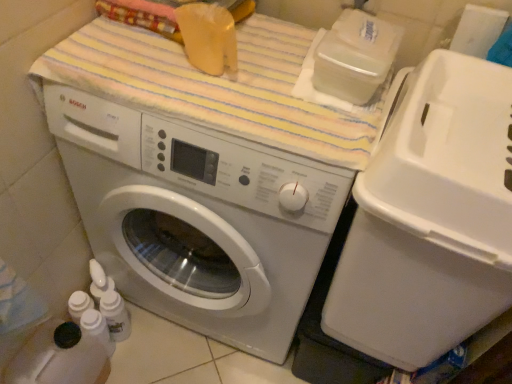
The width and height of the screenshot is (512, 384). What do you see at coordinates (219, 86) in the screenshot? I see `striped cotton bath towel at upper center` at bounding box center [219, 86].

Where is `white plastic water cooler at right`? This screenshot has height=384, width=512. white plastic water cooler at right is located at coordinates (430, 217).

Can you confirm if white plastic water cooler at right is taller than striped cotton bath towel at upper center?

Result: Yes, white plastic water cooler at right is taller than striped cotton bath towel at upper center.

Identify the location of bath towel that appears behind the white plastic water cooler at right. This screenshot has width=512, height=384. (219, 86).

In terms of width, does white plastic water cooler at right look wider or thinner when compared to striped cotton bath towel at upper center?

Considering their sizes, white plastic water cooler at right looks broader than striped cotton bath towel at upper center.

How different are the orientations of white plastic water cooler at right and striped cotton bath towel at upper center in degrees?

The angular difference between white plastic water cooler at right and striped cotton bath towel at upper center is 2.07 degrees.

Is point (315, 122) in front of point (482, 321)?

That is False.

Is striped cotton bath towel at upper center positioned beyond the bounds of white plastic water cooler at right?

striped cotton bath towel at upper center is positioned outside white plastic water cooler at right.

From a real-world perspective, is striped cotton bath towel at upper center positioned above or below white plastic water cooler at right?

From a real-world perspective, striped cotton bath towel at upper center is physically above white plastic water cooler at right.

Between striped cotton bath towel at upper center and white glossy washing machine at center, which one is positioned in front?

white glossy washing machine at center.

Does point (120, 57) lie behind point (250, 330)?

No, it is in front of (250, 330).

Is white glossy washing machine at center inside striped cotton bath towel at upper center?

Definitely not — white glossy washing machine at center is not inside striped cotton bath towel at upper center.

From the picture: Are white glossy washing machine at center and white plastic water cooler at right far apart?

white glossy washing machine at center is actually quite close to white plastic water cooler at right.

Considering the positions of point (256, 204) and point (464, 250), is point (256, 204) closer or farther from the camera than point (464, 250)?

Point (256, 204) is positioned farther from the camera compared to point (464, 250).

Is white glossy washing machine at center located outside white plastic water cooler at right?

Indeed, white glossy washing machine at center is completely outside white plastic water cooler at right.

You are a GUI agent. You are given a task and a screenshot of the screen. Output one action in this format:
    pyautogui.click(x=<x>, y=<y>)
    Task: Click on the washing machine located on the left of white plastic water cooler at right
    The width and height of the screenshot is (512, 384).
    Given the screenshot: What is the action you would take?
    pyautogui.click(x=198, y=218)

Which is more to the left, white glossy washing machine at center or striped cotton bath towel at upper center?

Positioned to the left is white glossy washing machine at center.

Which of these two, white glossy washing machine at center or striped cotton bath towel at upper center, is smaller?

With smaller size is striped cotton bath towel at upper center.

Is white glossy washing machine at center beside striped cotton bath towel at upper center?

No, white glossy washing machine at center is not touching striped cotton bath towel at upper center.

Considering the relative sizes of white plastic water cooler at right and white glossy washing machine at center in the image provided, is white plastic water cooler at right thinner than white glossy washing machine at center?

Indeed, white plastic water cooler at right has a lesser width compared to white glossy washing machine at center.

Is white plastic water cooler at right at the right side of white glossy washing machine at center?

Indeed, white plastic water cooler at right is positioned on the right side of white glossy washing machine at center.

The width and height of the screenshot is (512, 384). In the image, there is a white glossy washing machine at center. Identify the location of water cooler below it (from the image's perspective). (430, 217).

Is white plastic water cooler at right directly adjacent to white glossy washing machine at center?

No, white plastic water cooler at right is not making contact with white glossy washing machine at center.

Where is `water cooler that appears on the right of striped cotton bath towel at upper center`? water cooler that appears on the right of striped cotton bath towel at upper center is located at coordinates (430, 217).

You are a GUI agent. You are given a task and a screenshot of the screen. Output one action in this format:
    pyautogui.click(x=<x>, y=<y>)
    Task: Click on the bath towel above the white plastic water cooler at right (from a real-world perspective)
    The width and height of the screenshot is (512, 384).
    Given the screenshot: What is the action you would take?
    pyautogui.click(x=219, y=86)

Looking at the image, which one is located further to white plastic water cooler at right, white glossy washing machine at center or striped cotton bath towel at upper center?

Based on the image, striped cotton bath towel at upper center appears to be further to white plastic water cooler at right.

Estimate the real-world distances between objects in this image. Which object is closer to striped cotton bath towel at upper center, white glossy washing machine at center or white plastic water cooler at right?

The object closer to striped cotton bath towel at upper center is white glossy washing machine at center.

From the image, which object appears to be farther from white plastic water cooler at right, striped cotton bath towel at upper center or white glossy washing machine at center?

Based on the image, striped cotton bath towel at upper center appears to be further to white plastic water cooler at right.

When comparing their distances from white glossy washing machine at center, does white plastic water cooler at right or striped cotton bath towel at upper center seem further?

white plastic water cooler at right.

Considering their positions, is striped cotton bath towel at upper center positioned closer to white glossy washing machine at center than white plastic water cooler at right?

striped cotton bath towel at upper center.

From the image, which object appears to be nearer to striped cotton bath towel at upper center, white plastic water cooler at right or white glossy washing machine at center?

Based on the image, white glossy washing machine at center appears to be nearer to striped cotton bath towel at upper center.

Identify the location of bath towel situated between white glossy washing machine at center and white plastic water cooler at right from left to right. (219, 86).